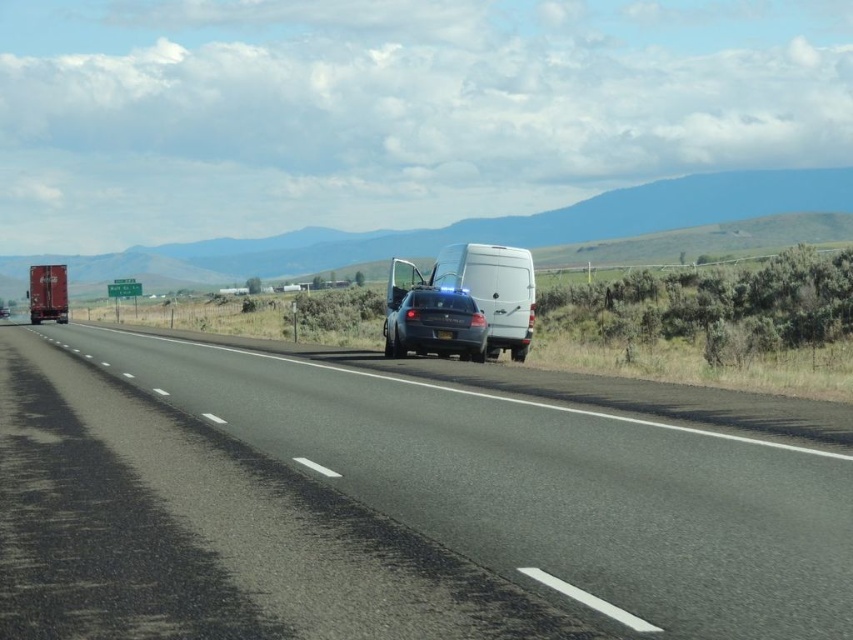
You are a drone operator trying to capture a photo of the white matte van at center from above. The drone must stay within the highway area. Based on the scene description, what are the coordinates where you should direct the drone to capture the van?

The white matte van at center is located at coordinates (492, 291). Direct the drone to these coordinates to capture the van from above while staying within the highway area.

You are a drone operator trying to capture a photo of the black asphalt road at center from above. What are the coordinates you should aim for?

The coordinates for the black asphalt road at center are at point (387, 506).

In the scene shown: You are a driver approaching the scene and need to stop your car. The car requires 6 meters to safely come to a stop. Is there enough space on the black asphalt road at center to stop safely?

The black asphalt road at center is 5.43 meters away from viewer. Since the car needs 6 meters to stop and the distance is only 5.43 meters, there is not enough space to stop safely.